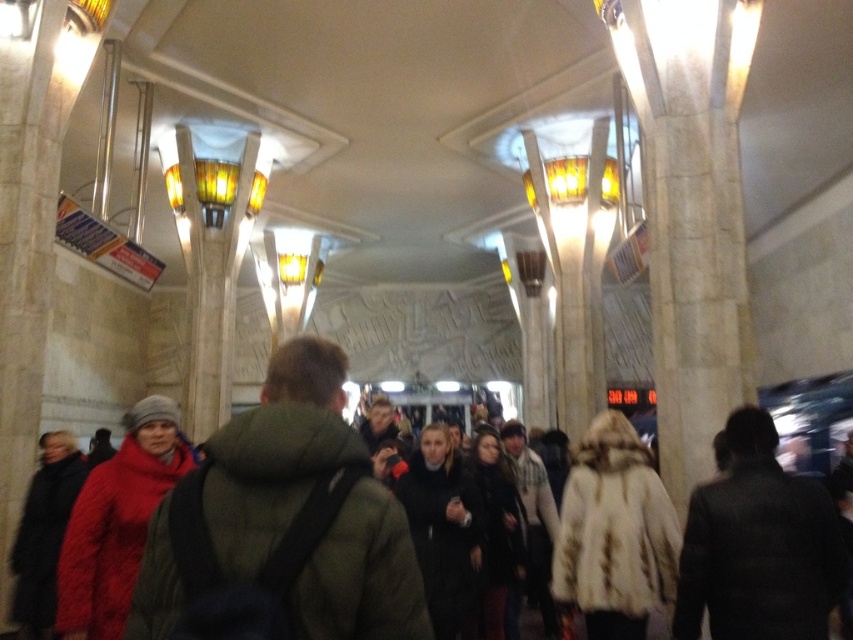
Is dark gray coat at center further to the viewer compared to matte red coat at center?

No, it is not.

Is dark gray coat at center to the right of matte red coat at center from the viewer's perspective?

Yes, dark gray coat at center is to the right of matte red coat at center.

The height and width of the screenshot is (640, 853). In order to click on dark gray coat at center in this screenshot , I will do `click(758, 545)`.

In the scene shown: Does dark gray coat at center lie in front of fur coat at center?

Yes.

From the picture: Measure the distance between dark gray coat at center and fur coat at center.

32.63 inches

What do you see at coordinates (758, 545) in the screenshot? The height and width of the screenshot is (640, 853). I see `dark gray coat at center` at bounding box center [758, 545].

You are a GUI agent. You are given a task and a screenshot of the screen. Output one action in this format:
    pyautogui.click(x=<x>, y=<y>)
    Task: Click on the dark gray coat at center
    The image size is (853, 640).
    Given the screenshot: What is the action you would take?
    pyautogui.click(x=758, y=545)

Between matte green jacket at center and fur coat at center, which one is positioned higher?

matte green jacket at center is above.

Which is behind, point (318, 632) or point (564, 563)?

The point (564, 563) is more distant.

This screenshot has width=853, height=640. Find the location of `matte green jacket at center`. matte green jacket at center is located at coordinates (281, 525).